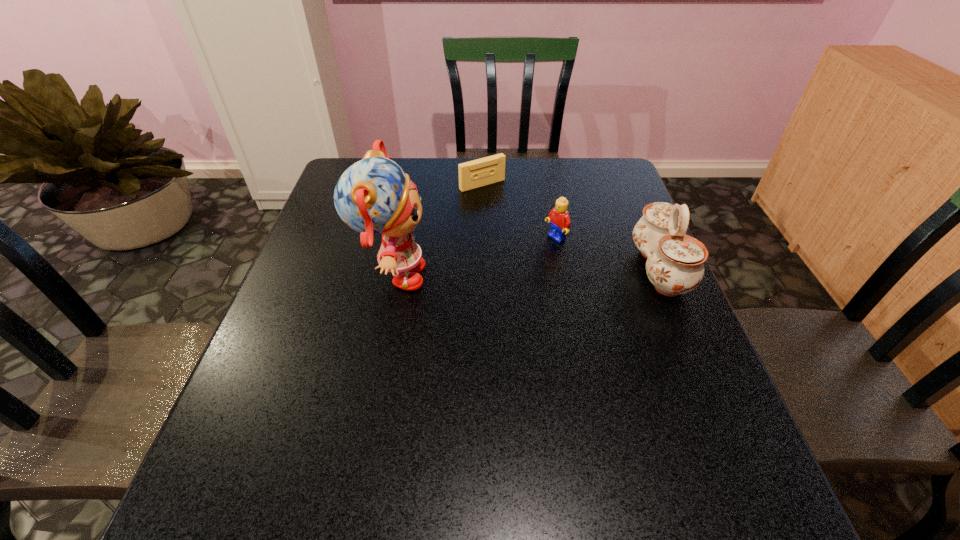
In order to click on vacant region located by the handle of the third shortest object in this screenshot , I will do `click(602, 269)`.

At what (x,y) coordinates should I click in order to perform the action: click on vacant space located 0.330m by the handle of the third shortest object. Please return your answer as a coordinate pair (x, y). The height and width of the screenshot is (540, 960). Looking at the image, I should click on (501, 269).

The width and height of the screenshot is (960, 540). Identify the location of free region located on the front-facing side of the second shortest object. (450, 300).

Find the location of a particular element. free space located on the front-facing side of the second shortest object is located at coordinates (502, 270).

The height and width of the screenshot is (540, 960). Identify the location of vacant space located on the front-facing side of the second shortest object. (446, 302).

The width and height of the screenshot is (960, 540). I want to click on vacant space located 0.100m at the front of the videotape with spools, so click(x=509, y=208).

The width and height of the screenshot is (960, 540). I want to click on free region located at the front of the videotape with spools, so click(x=563, y=264).

Where is `vacant point located 0.280m at the front of the videotape with spools`? Image resolution: width=960 pixels, height=540 pixels. vacant point located 0.280m at the front of the videotape with spools is located at coordinates (543, 244).

At what (x,y) coordinates should I click in order to perform the action: click on object positioned at the far edge. Please return your answer as a coordinate pair (x, y). Looking at the image, I should click on (488, 170).

Identify the location of object that is at the left edge. The height and width of the screenshot is (540, 960). (373, 196).